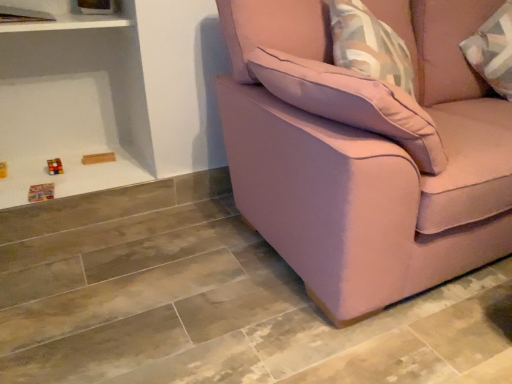
Question: Considering the positions of pink fabric couch at right and pink fabric pillow at upper right in the image, is pink fabric couch at right taller or shorter than pink fabric pillow at upper right?

Choices:
 (A) short
 (B) tall

Answer: (B)

Question: In terms of width, does pink fabric couch at right look wider or thinner when compared to pink fabric pillow at upper right?

Choices:
 (A) thin
 (B) wide

Answer: (B)

Question: Which object is positioned closest to the pink fabric couch at right?

Choices:
 (A) white glossy shelf at upper left
 (B) pink fabric pillow at upper right

Answer: (B)

Question: Estimate the real-world distances between objects in this image. Which object is farther from the white glossy shelf at upper left?

Choices:
 (A) pink fabric couch at right
 (B) pink fabric pillow at upper right

Answer: (A)